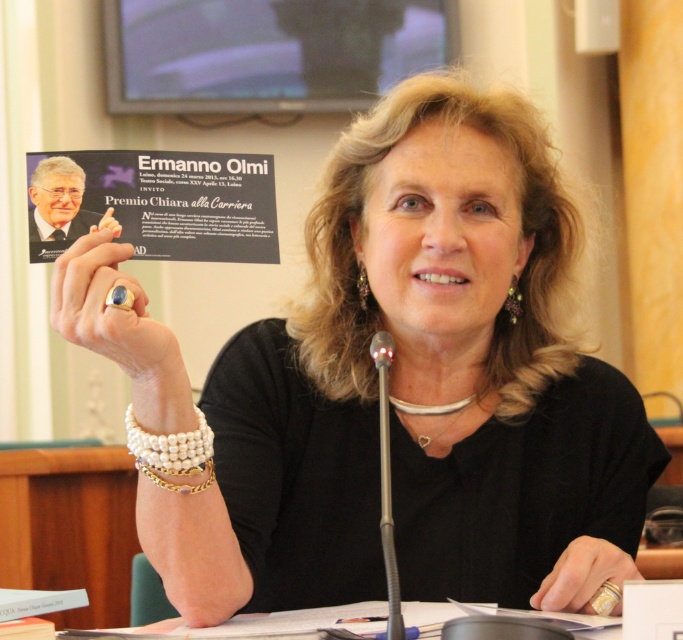
You are a photographer at the event and need to capture a closeup of the gold ring at lower right and the black plastic microphone at center. Which object should you zoom in on first to ensure it fits in the frame before adjusting?

The gold ring at lower right is not as tall as the black plastic microphone at center, so you should zoom in on the gold ring at lower right first to ensure it fits in the frame before adjusting for the taller microphone.